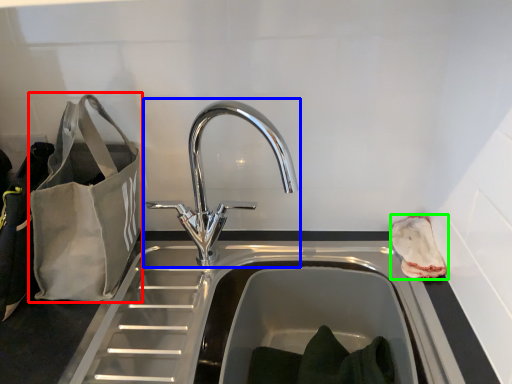
Question: Based on their relative distances, which object is farther from bag (highlighted by a red box)? Choose from tap (highlighted by a blue box) and pouch (highlighted by a green box).

Choices:
 (A) tap
 (B) pouch

Answer: (B)